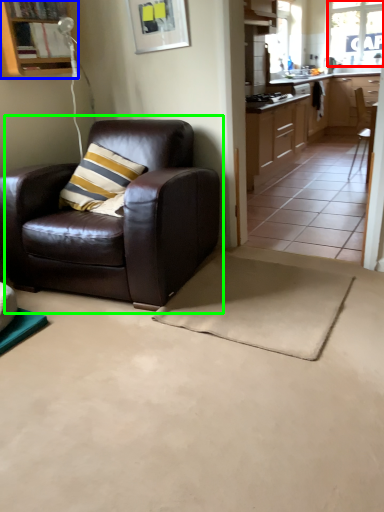
Question: Estimate the real-world distances between objects in this image. Which object is farther from window (highlighted by a red box), cabinetry (highlighted by a blue box) or chair (highlighted by a green box)?

Choices:
 (A) cabinetry
 (B) chair

Answer: (B)